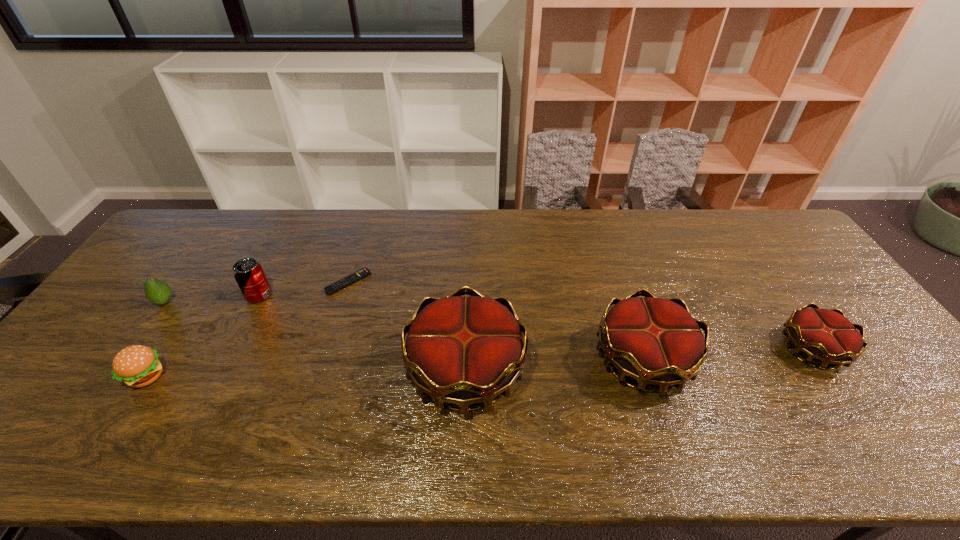
Find the location of a particular element. This screenshot has width=960, height=540. the leftmost crown is located at coordinates (463, 350).

I want to click on the second shortest crown, so click(656, 341).

The height and width of the screenshot is (540, 960). Identify the location of the sixth object from left to right. (656, 341).

Where is `the shortest crown`? The image size is (960, 540). the shortest crown is located at coordinates (825, 335).

The image size is (960, 540). I want to click on the rightmost object, so click(825, 335).

I want to click on the leftmost object, so click(158, 292).

Identify the location of remote control. (364, 272).

Identify the location of the fourth object from left to right. (364, 272).

The width and height of the screenshot is (960, 540). I want to click on the second object from left to right, so click(x=137, y=366).

Identify the location of the third tallest object. (248, 273).